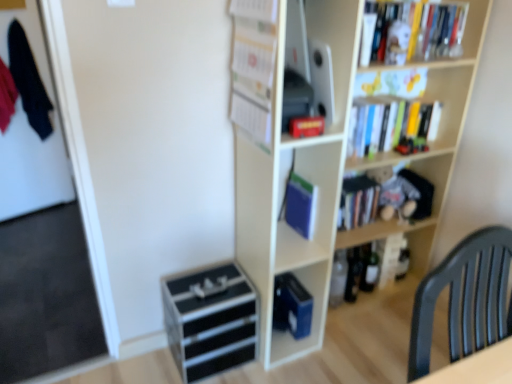
Locate an element on the screen. free spot in front of wooden bookcase at upper right is located at coordinates (364, 349).